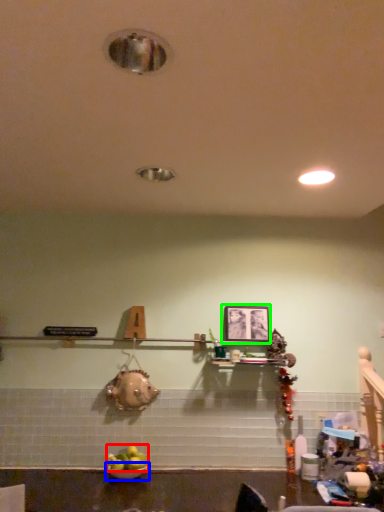
Question: Which is nearer to the fruit (highlighted by a red box)? bowl (highlighted by a blue box) or picture frame (highlighted by a green box).

Choices:
 (A) bowl
 (B) picture frame

Answer: (A)